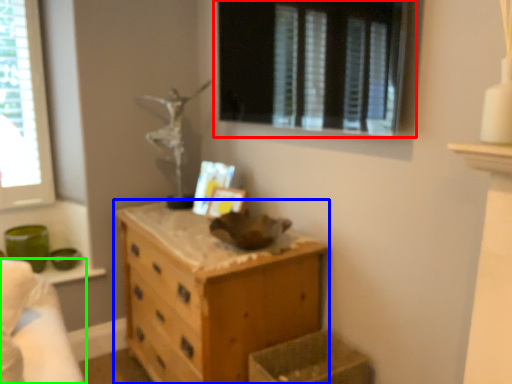
Question: Which object is the closest to the window (highlighted by a red box)? Choose among these: chest of drawers (highlighted by a blue box) or bed (highlighted by a green box).

Choices:
 (A) chest of drawers
 (B) bed

Answer: (A)